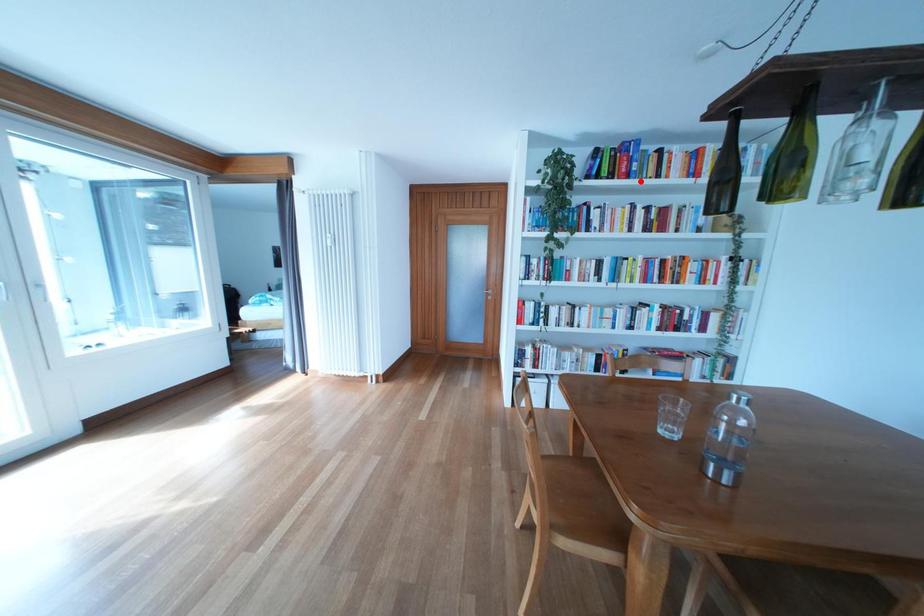
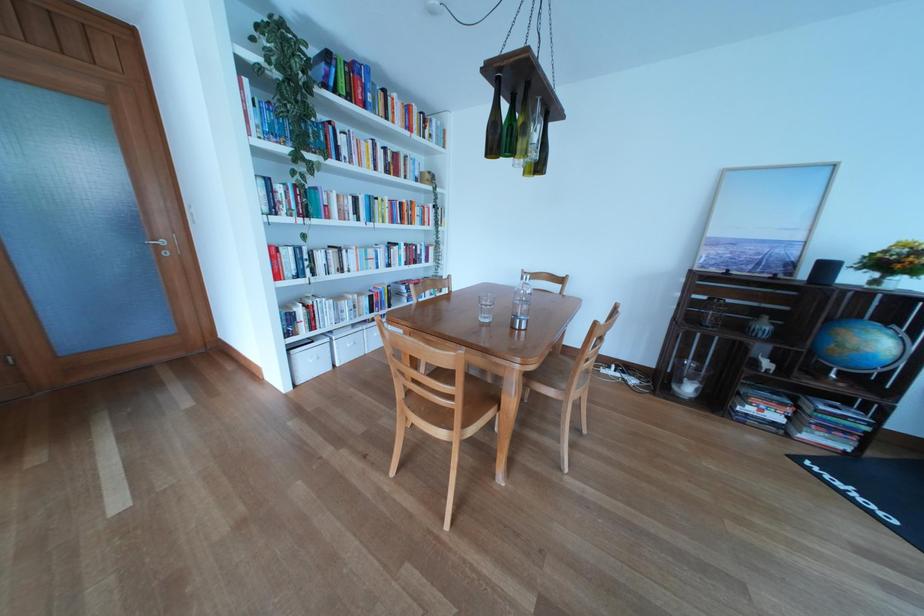
The point at the highlighted location is marked in the first image. Where is the corresponding point in the second image?

(378, 111)